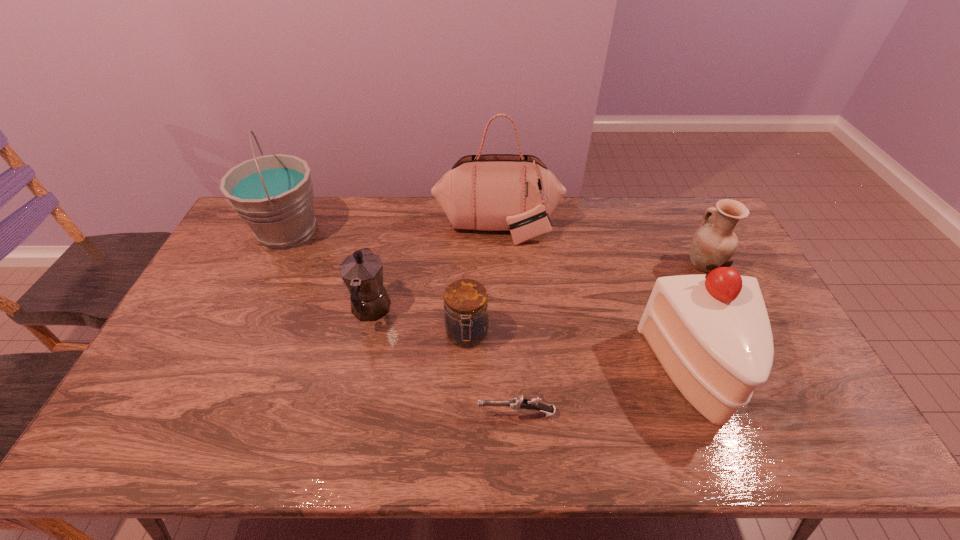
In order to click on object positioned at the near edge in this screenshot , I will do `click(711, 333)`.

The image size is (960, 540). I want to click on object located at the left edge, so click(x=273, y=194).

Image resolution: width=960 pixels, height=540 pixels. Identify the location of object that is at the right edge. (716, 243).

Locate an element on the screen. The width and height of the screenshot is (960, 540). object that is at the far left corner is located at coordinates (273, 194).

In the image, there is a desktop. In order to click on vacant space at the far edge in this screenshot , I will do `click(570, 204)`.

Where is `free space at the near edge of the desktop`? free space at the near edge of the desktop is located at coordinates (684, 439).

In the image, there is a desktop. Identify the location of vacant space at the left edge. Image resolution: width=960 pixels, height=540 pixels. (209, 307).

In the image, there is a desktop. Where is `vacant space at the far right corner`? The image size is (960, 540). vacant space at the far right corner is located at coordinates (702, 202).

Where is `free space between the handbag and the shortest object`? free space between the handbag and the shortest object is located at coordinates (507, 321).

The height and width of the screenshot is (540, 960). I want to click on unoccupied area between the pottery and the second object from left to right, so click(537, 287).